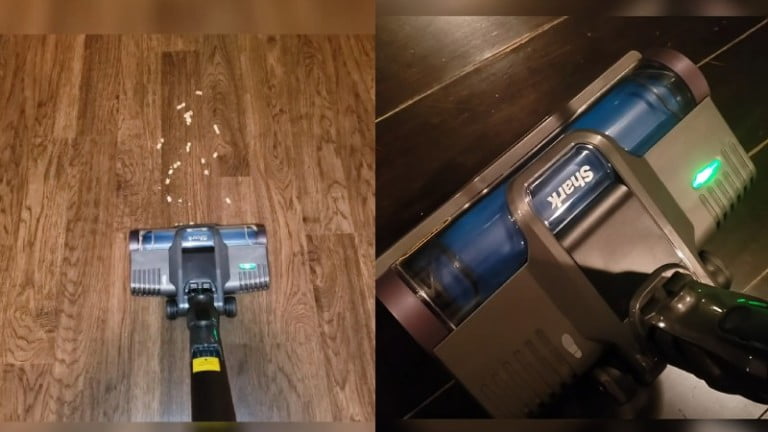
At what (x,y) coordinates should I click in order to perform the action: click on vaccum. Please return your answer as a coordinate pair (x, y). The image size is (768, 432). Looking at the image, I should click on (560, 325).